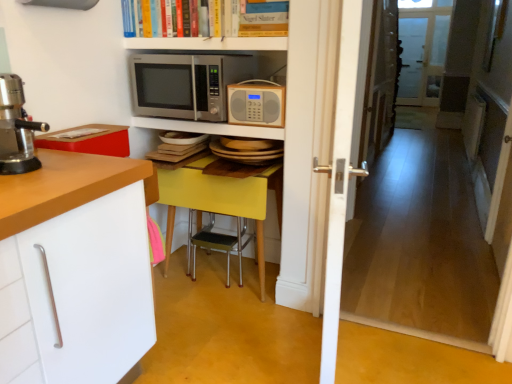
Question: Are yellow matte table at center and hardcover book at upper center making contact?

Choices:
 (A) no
 (B) yes

Answer: (A)

Question: Considering the relative positions of yellow matte table at center and hardcover book at upper center in the image provided, is yellow matte table at center in front of hardcover book at upper center?

Choices:
 (A) no
 (B) yes

Answer: (A)

Question: From a real-world perspective, is yellow matte table at center positioned under hardcover book at upper center based on gravity?

Choices:
 (A) yes
 (B) no

Answer: (A)

Question: From a real-world perspective, is yellow matte table at center positioned over hardcover book at upper center based on gravity?

Choices:
 (A) yes
 (B) no

Answer: (B)

Question: Is yellow matte table at center bigger than hardcover book at upper center?

Choices:
 (A) no
 (B) yes

Answer: (B)

Question: Is yellow matte table at center at the left side of hardcover book at upper center?

Choices:
 (A) yes
 (B) no

Answer: (B)

Question: From a real-world perspective, is transparent glass screen door at upper right physically above white wooden door at center?

Choices:
 (A) yes
 (B) no

Answer: (A)

Question: Is transparent glass screen door at upper right wider than white wooden door at center?

Choices:
 (A) yes
 (B) no

Answer: (B)

Question: Does transparent glass screen door at upper right have a lesser width compared to white wooden door at center?

Choices:
 (A) no
 (B) yes

Answer: (B)

Question: Considering the relative positions of transparent glass screen door at upper right and white wooden door at center in the image provided, is transparent glass screen door at upper right to the right of white wooden door at center from the viewer's perspective?

Choices:
 (A) no
 (B) yes

Answer: (B)

Question: From the image's perspective, does transparent glass screen door at upper right appear lower than white wooden door at center?

Choices:
 (A) no
 (B) yes

Answer: (A)

Question: Is transparent glass screen door at upper right bigger than white wooden door at center?

Choices:
 (A) yes
 (B) no

Answer: (B)

Question: Does metallic silver microwave at upper center, the 1th shelf from the bottom, come in front of yellow matte table at center?

Choices:
 (A) no
 (B) yes

Answer: (B)